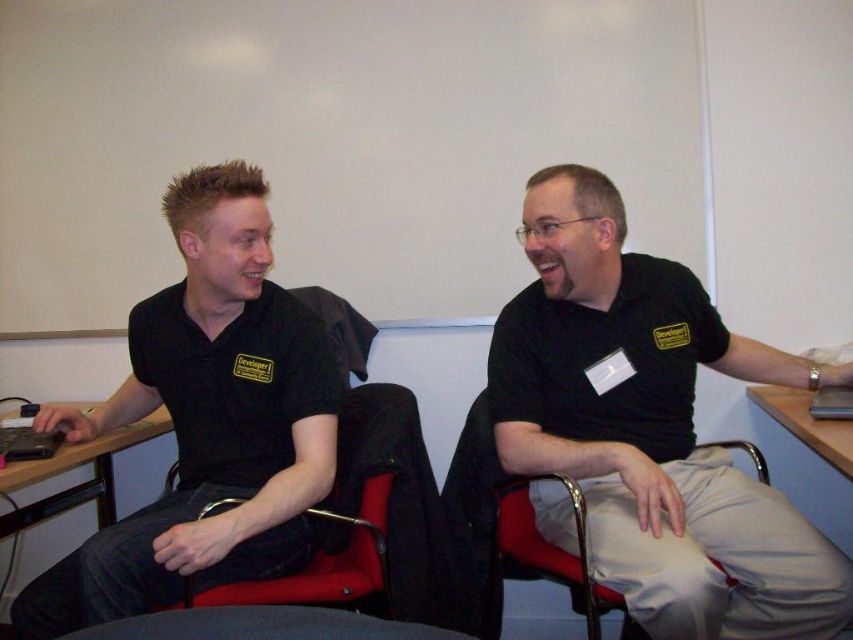
The image size is (853, 640). I want to click on black matte shirt at left, so click(206, 420).

Between black matte shirt at left and wooden desk at right, which one appears on the right side from the viewer's perspective?

From the viewer's perspective, wooden desk at right appears more on the right side.

Between point (219, 182) and point (770, 406), which one is positioned in front?

Positioned in front is point (219, 182).

The image size is (853, 640). Find the location of `black matte shirt at left`. black matte shirt at left is located at coordinates (206, 420).

Is black matte shirt at left above gray fabric chair at lower center?

Indeed, black matte shirt at left is positioned over gray fabric chair at lower center.

In the scene shown: Who is taller, black matte shirt at left or gray fabric chair at lower center?

With more height is black matte shirt at left.

What do you see at coordinates (206, 420) in the screenshot? I see `black matte shirt at left` at bounding box center [206, 420].

Locate an element on the screen. black matte shirt at left is located at coordinates (206, 420).

Does black matte shirt at center appear over gray fabric chair at lower center?

Yes.

Which is in front, point (799, 532) or point (328, 628)?

Positioned in front is point (328, 628).

You are a GUI agent. You are given a task and a screenshot of the screen. Output one action in this format:
    pyautogui.click(x=<x>, y=<y>)
    Task: Click on the black matte shirt at center
    This screenshot has width=853, height=640.
    Given the screenshot: What is the action you would take?
    pyautogui.click(x=651, y=428)